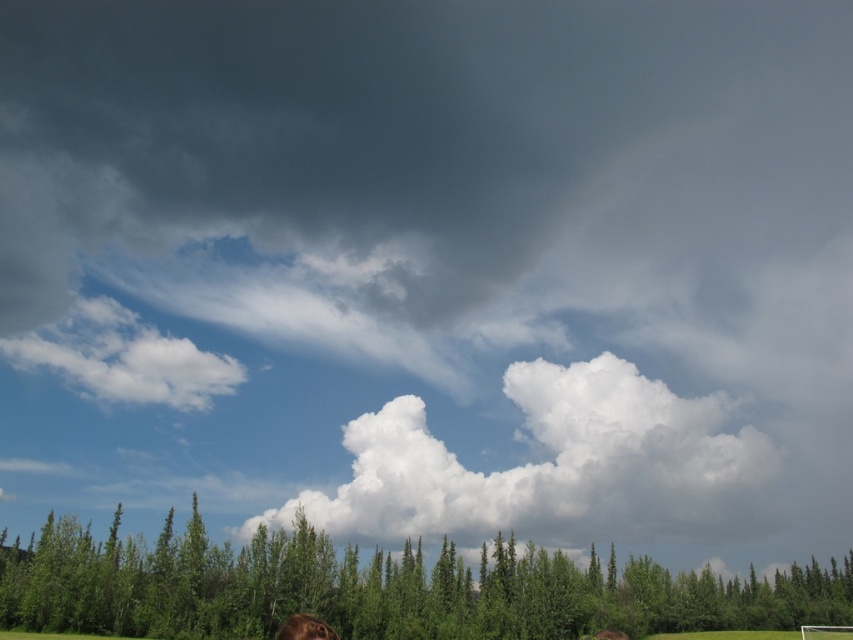
Based on the photo, between white fluffy cloud at center and white fluffy cloud at upper left, which one appears on the left side from the viewer's perspective?

white fluffy cloud at upper left is more to the left.

Can you confirm if white fluffy cloud at center is positioned above white fluffy cloud at upper left?

Incorrect, white fluffy cloud at center is not positioned above white fluffy cloud at upper left.

Which is in front, point (646, 435) or point (97, 312)?

Point (646, 435) is in front.

Where is `white fluffy cloud at center`? The image size is (853, 640). white fluffy cloud at center is located at coordinates (555, 467).